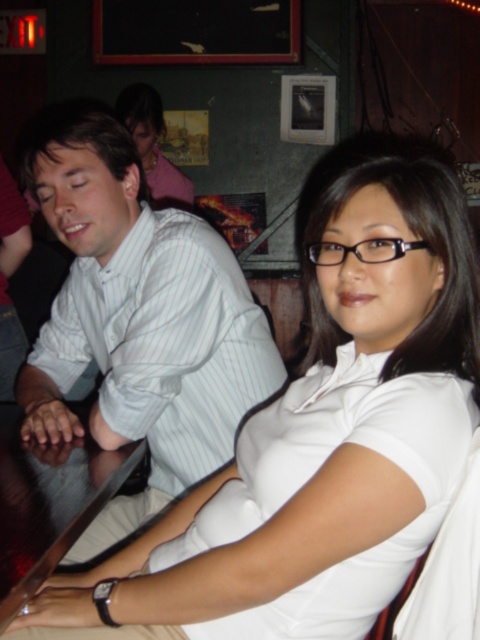
What do you see at coordinates (137, 317) in the screenshot?
I see `white striped shirt at left` at bounding box center [137, 317].

Does white striped shirt at left appear over dark wood table at lower left?

Yes, white striped shirt at left is above dark wood table at lower left.

The height and width of the screenshot is (640, 480). What do you see at coordinates (137, 317) in the screenshot? I see `white striped shirt at left` at bounding box center [137, 317].

Where is `white striped shirt at left`? The height and width of the screenshot is (640, 480). white striped shirt at left is located at coordinates (137, 317).

Which is more to the left, dark wood table at lower left or pink fabric at upper left?

pink fabric at upper left is more to the left.

Does point (121, 468) come in front of point (184, 196)?

That is True.

This screenshot has height=640, width=480. Find the location of `dark wood table at lower left`. dark wood table at lower left is located at coordinates (48, 502).

From the picture: Does white striped shirt at left appear on the left side of pink fabric at upper left?

Incorrect, white striped shirt at left is not on the left side of pink fabric at upper left.

Who is higher up, white striped shirt at left or pink fabric at upper left?

Positioned higher is pink fabric at upper left.

Identify the location of white striped shirt at left. (137, 317).